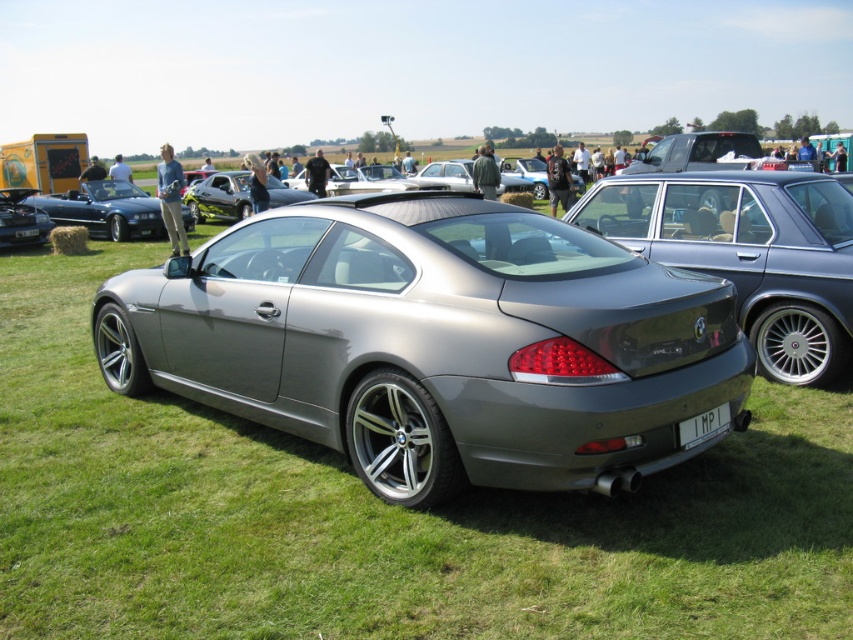
Is metallic silver car at center in front of white plastic license plate at center?

No, metallic silver car at center is further to the viewer.

Locate an element on the screen. This screenshot has width=853, height=640. metallic silver car at center is located at coordinates (219, 196).

Does metallic silver car at left appear on the right side of metallic silver car at center?

Incorrect, metallic silver car at left is not on the right side of metallic silver car at center.

Is metallic silver car at left taller than metallic silver car at center?

Yes.

Is point (131, 211) closer to viewer compared to point (207, 200)?

Yes, point (131, 211) is in front of point (207, 200).

The image size is (853, 640). In order to click on metallic silver car at left in this screenshot , I will do `click(103, 209)`.

Looking at this image, is satin metallic car at center positioned behind white plastic license plate at center?

No, it is in front of white plastic license plate at center.

What do you see at coordinates (436, 342) in the screenshot? I see `satin metallic car at center` at bounding box center [436, 342].

The image size is (853, 640). What are the coordinates of `satin metallic car at center` in the screenshot? It's located at (436, 342).